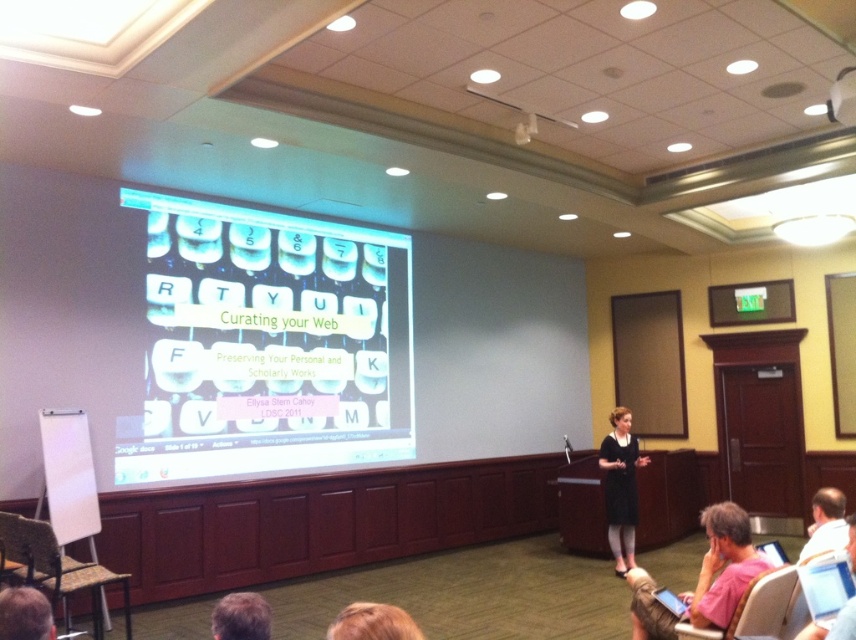
You are an attendee sitting in the conference room and want to pass your notes to the person with blonde hair at lower center. There is a pink fabric laptop at lower right on the table. Can you directly hand them the notes without moving around the laptop?

The pink fabric laptop at lower right is further to the viewer than blonde hair at lower center, so the laptop is closer to you. This means the person with blonde hair at lower center is sitting behind the laptop. You would need to move the laptop or reach around it to hand them the notes directly.

You are sitting in the wooden chair at lower left located at point (55, 564). You want to reach the whiteboard stand on the left side of the image. Is the whiteboard stand to your left or right side?

The whiteboard stand is on the left side of the image, so from your position in the wooden chair at lower left, the whiteboard stand would be to your right side.